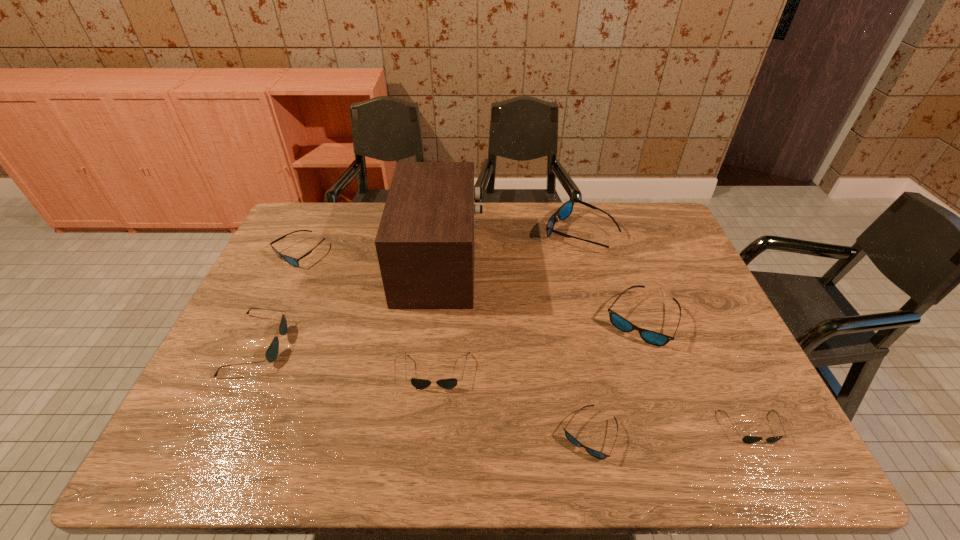
The height and width of the screenshot is (540, 960). I want to click on the tallest object, so [425, 241].

Where is `the biggest blue sunglasses`? The height and width of the screenshot is (540, 960). the biggest blue sunglasses is located at coordinates (565, 210).

This screenshot has height=540, width=960. In order to click on the tallest sunglasses in this screenshot , I will do `click(565, 210)`.

The height and width of the screenshot is (540, 960). Identify the location of the second biggest blue sunglasses. (654, 338).

The image size is (960, 540). I want to click on the leftmost black sunglasses, so pyautogui.click(x=271, y=354).

Identify the location of the leftmost blue sunglasses. (292, 261).

Where is `the second black sunglasses from right to left`? the second black sunglasses from right to left is located at coordinates (450, 383).

I want to click on the third sunglasses from left to right, so click(450, 383).

The image size is (960, 540). What are the coordinates of `the smallest blue sunglasses` in the screenshot? It's located at (574, 441).

Find the location of a particular element. The width and height of the screenshot is (960, 540). the nearest black sunglasses is located at coordinates (747, 439).